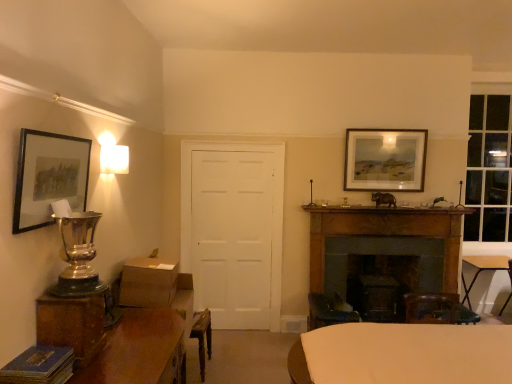
In order to click on free point above white matte door at center (from a real-world perspective) in this screenshot , I will do `click(229, 142)`.